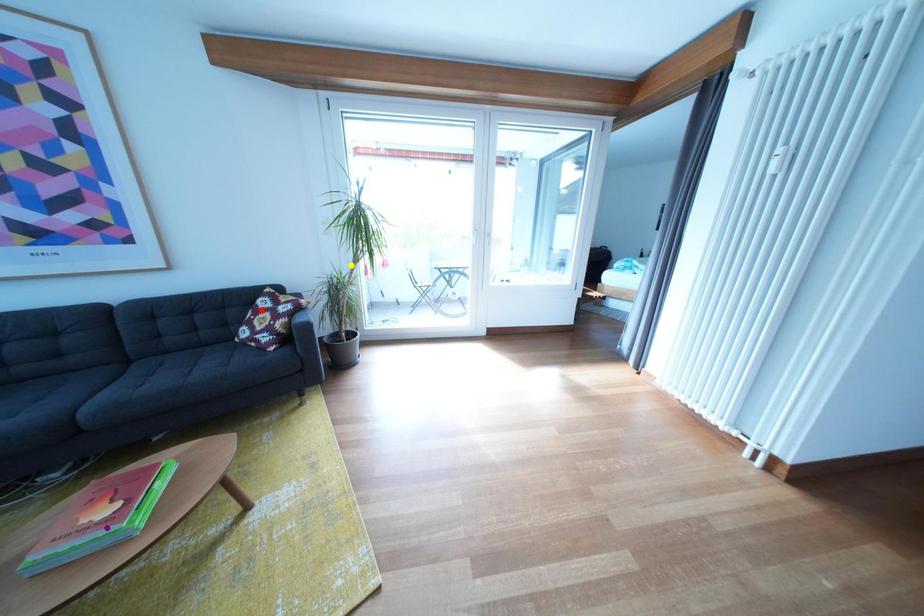
Order these from nearest to farthest:
purple point, red point, yellow point

1. yellow point
2. red point
3. purple point